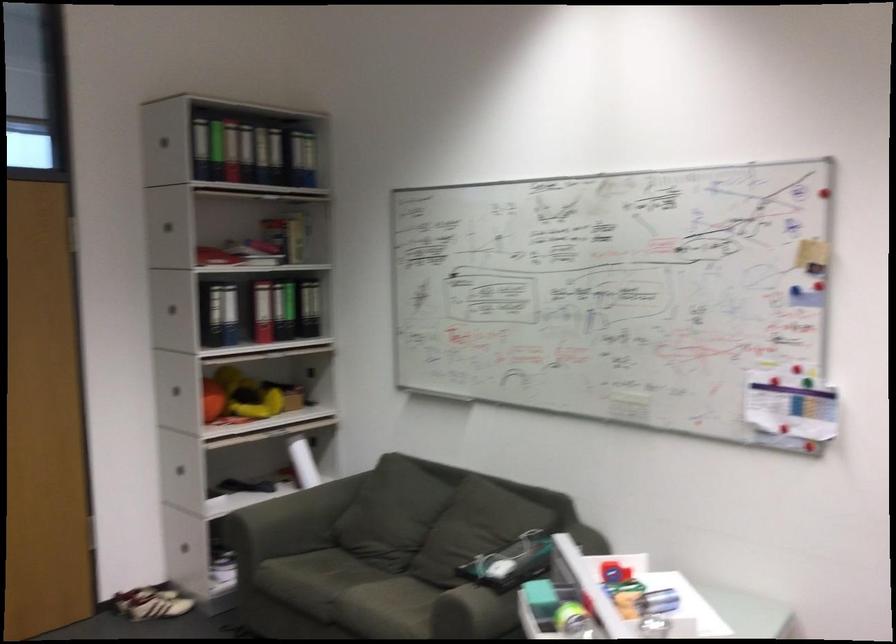
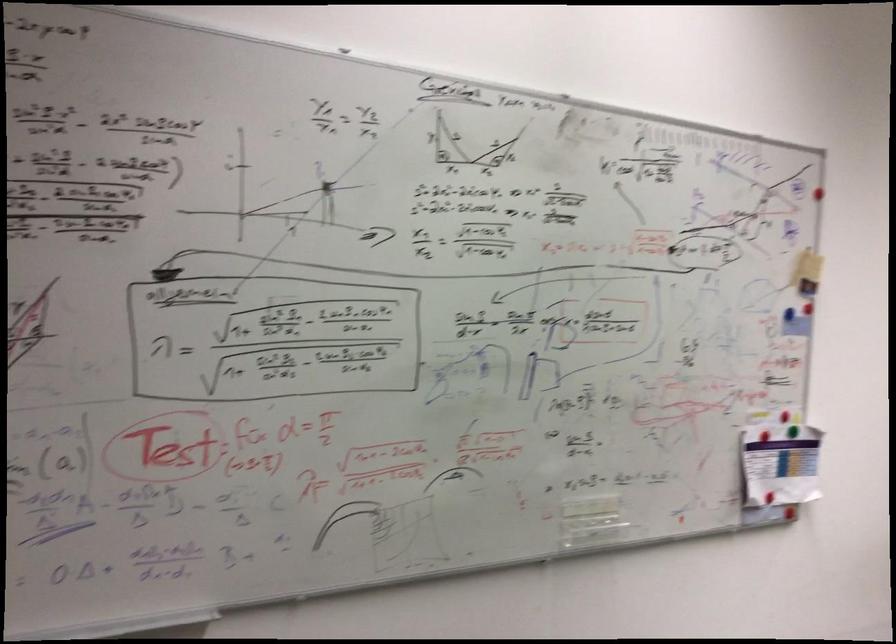
Find the pixel in the second image that matches pixel 820 192 in the first image.

(817, 198)